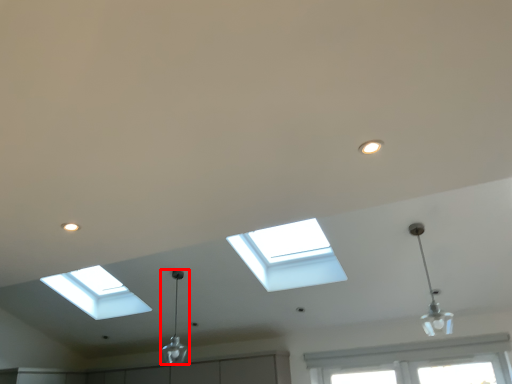
Question: In this image, where is lamp (annotated by the red box) located relative to lamp?

Choices:
 (A) left
 (B) right

Answer: (A)